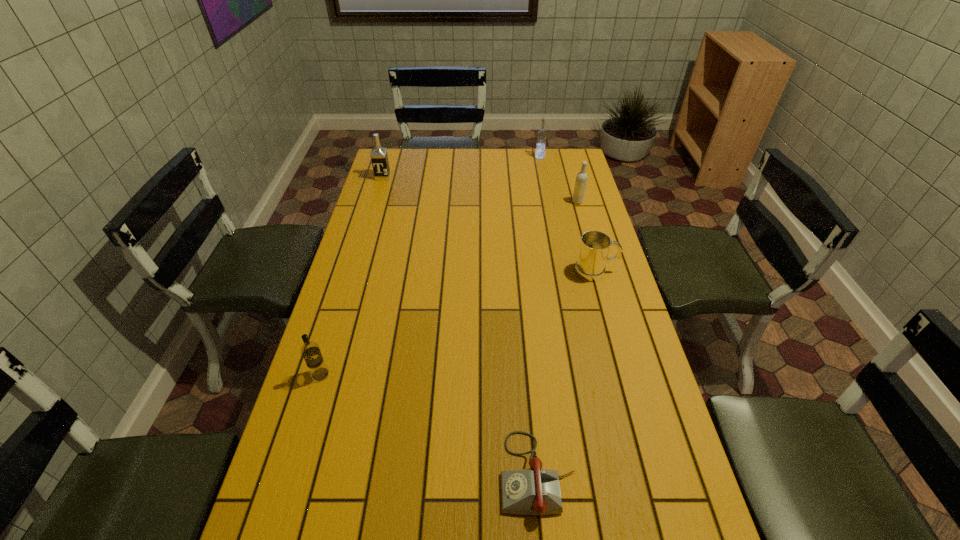
The width and height of the screenshot is (960, 540). In order to click on the closest object relative to the mug in this screenshot , I will do `click(581, 179)`.

Identify the location of object that is the second closest one to the nearest vodka. The height and width of the screenshot is (540, 960). (590, 266).

You are a GUI agent. You are given a task and a screenshot of the screen. Output one action in this format:
    pyautogui.click(x=<x>, y=<y>)
    Task: Click on the vodka object that ranks as the closest to the mug
    Image resolution: width=960 pixels, height=540 pixels.
    Given the screenshot: What is the action you would take?
    pyautogui.click(x=581, y=179)

Locate an element on the screen. The width and height of the screenshot is (960, 540). vodka that stands as the closest to the nearest vodka is located at coordinates (379, 157).

This screenshot has height=540, width=960. I want to click on free location that satisfies the following two spatial constraints: 1. on the front side of the farthest object; 2. on the dial of the shortest object, so click(x=602, y=474).

Where is `vacant space that satisfies the following two spatial constraints: 1. on the front label of the second farthest vodka; 2. on the right side of the third farthest object`? This screenshot has height=540, width=960. vacant space that satisfies the following two spatial constraints: 1. on the front label of the second farthest vodka; 2. on the right side of the third farthest object is located at coordinates (375, 202).

Image resolution: width=960 pixels, height=540 pixels. Find the location of `vacant region that satisfies the following two spatial constraints: 1. on the front label of the third farthest object; 2. on the left side of the second farthest object`. vacant region that satisfies the following two spatial constraints: 1. on the front label of the third farthest object; 2. on the left side of the second farthest object is located at coordinates (375, 202).

Where is `free space that satisfies the following two spatial constraints: 1. on the front label of the second farthest object; 2. on the right side of the fourth nearest object`? The height and width of the screenshot is (540, 960). free space that satisfies the following two spatial constraints: 1. on the front label of the second farthest object; 2. on the right side of the fourth nearest object is located at coordinates tap(375, 202).